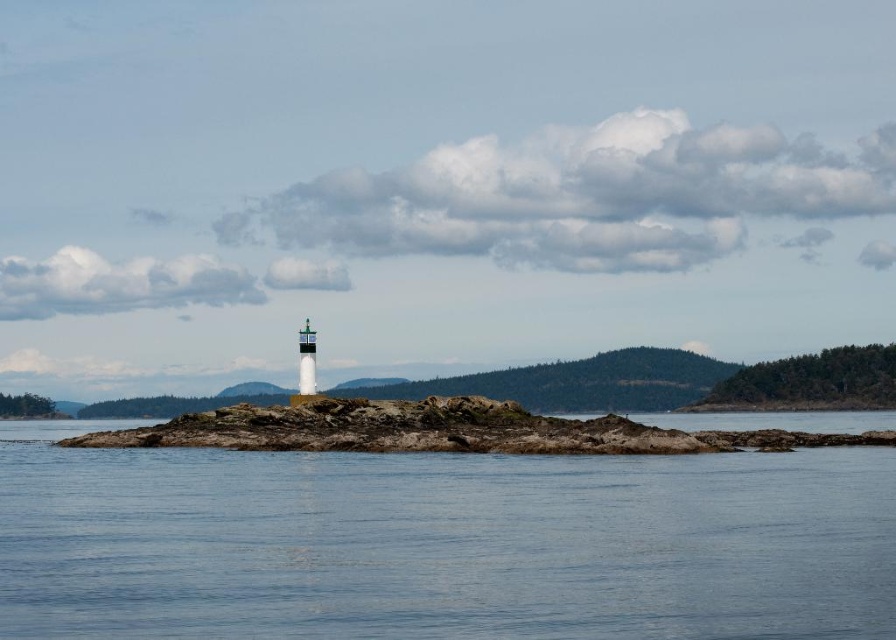
You are a bird soaring above the coastal scene. You see the clear blue water at center and the rugged stone island at center. Which one is closer to your current position?

The clear blue water at center is closer to your current position because it is in front of the rugged stone island at center.

You are a photographer standing on a boat 100 feet away from the clear blue water at center. You want to capture a closeup shot of the water. Do you think you can get a clear shot without moving closer?

The clear blue water at center is 85.28 feet away from camera. Since you are 100 feet away, you are farther than the required distance, so you can get a clear closeup shot without moving closer.

You are a bird soaring above the coastal scene. You see the clear blue water at center and the rugged stone island at center. Which one appears taller from your perspective?

The clear blue water at center appears taller than the rugged stone island at center from your perspective.